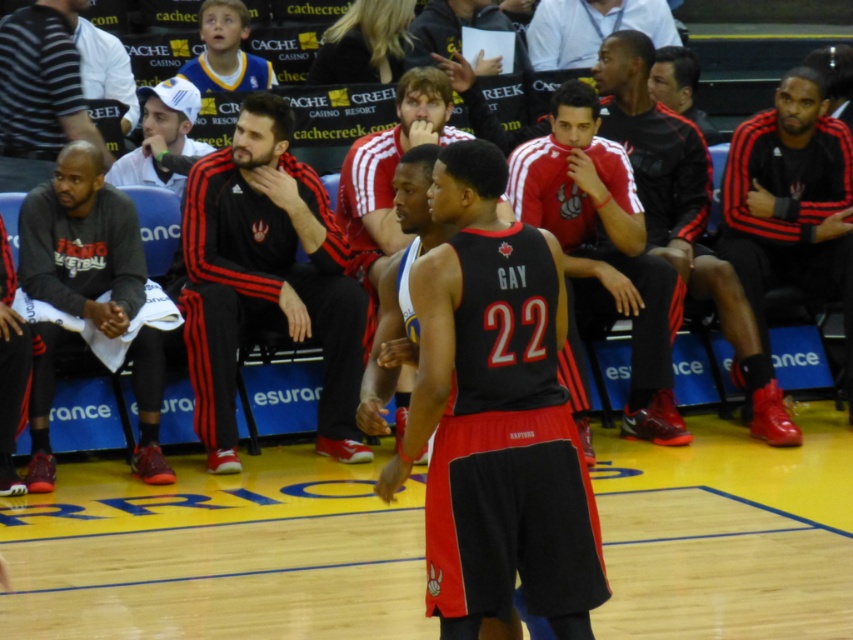
You are a photographer standing in the middle of the court. You want to take a photo of both the point at (x=566, y=150) and the point at (x=33, y=262). Which point should you focus on first to ensure both are in focus?

You should focus on the point at (x=566, y=150) first because it is closer to the camera than the point at (x=33, y=262), ensuring both points are within the depth of field.

You are a photographer trying to capture a closeup shot of both the black jersey at center and the black adidas tracksuit at center. Given their sizes, which one would require you to move closer to get a clear photo?

The black jersey at center occupies less space than the black adidas tracksuit at center, so you would need to move closer to the black jersey at center to capture it clearly in the photo.

You are a referee standing at the center of the basketball court. You need to check if the distance between the red matte jersey at center and the dark gray jersey at left is within the 15 feet safety zone required for player interactions during timeouts. Can you confirm if they are within the safety zone?

The red matte jersey at center and the dark gray jersey at left are 14.99 feet apart, which is within the 15 feet safety zone required for player interactions during timeouts. Therefore, they are within the safety zone.